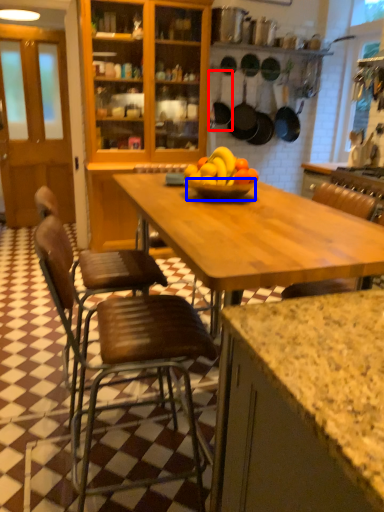
Question: Which of the following is the closest to the observer, frying pan (highlighted by a red box) or glass bowl (highlighted by a blue box)?

Choices:
 (A) frying pan
 (B) glass bowl

Answer: (B)